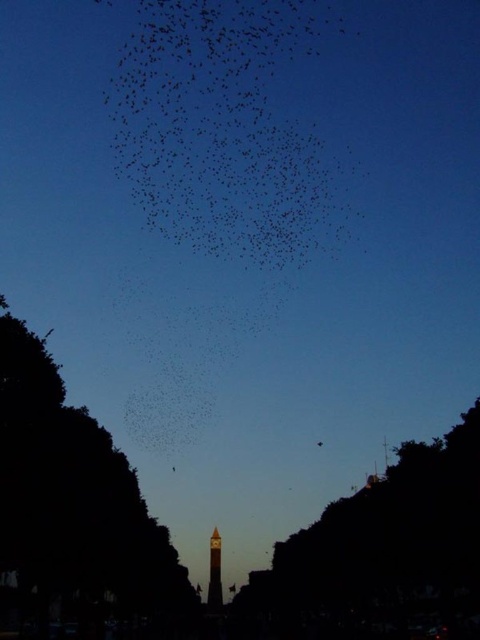
Question: Considering the relative positions of black matte birds at upper center and dark green leafy tree at left in the image provided, where is black matte birds at upper center located with respect to dark green leafy tree at left?

Choices:
 (A) left
 (B) right

Answer: (B)

Question: Estimate the real-world distances between objects in this image. Which object is farther from the dark green leafy tree at left?

Choices:
 (A) black matte birds at upper center
 (B) dark green leafy tree at lower right
 (C) black matte bird at upper center

Answer: (A)

Question: Which of the following is the farthest from the observer?

Choices:
 (A) (316, 243)
 (B) (211, 598)

Answer: (B)

Question: Does smooth stone bell tower at center appear on the left side of black matte bird at upper center?

Choices:
 (A) no
 (B) yes

Answer: (B)

Question: Does black matte birds at upper center appear on the right side of smooth stone bell tower at center?

Choices:
 (A) yes
 (B) no

Answer: (A)

Question: Which is farther from the smooth stone bell tower at center?

Choices:
 (A) black matte bird at upper center
 (B) black matte birds at upper center
 (C) dark green leafy tree at left
 (D) dark green leafy tree at lower right

Answer: (B)